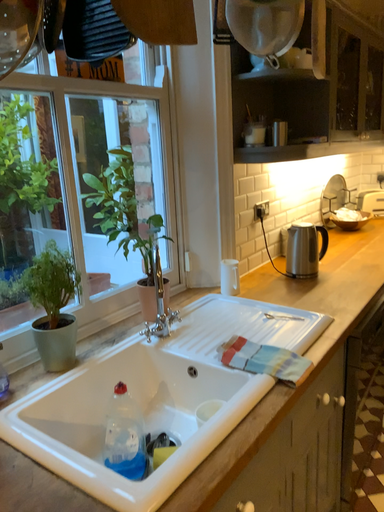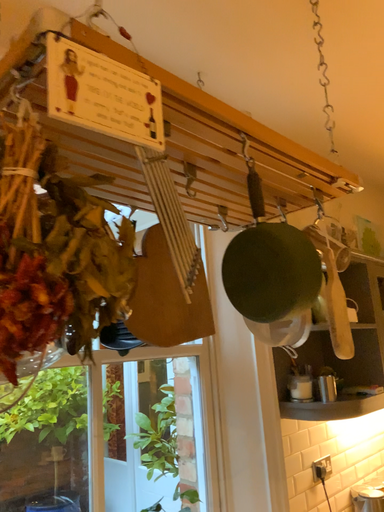
Question: How did the camera likely rotate when shooting the video?

Choices:
 (A) rotated downward
 (B) rotated upward

Answer: (B)